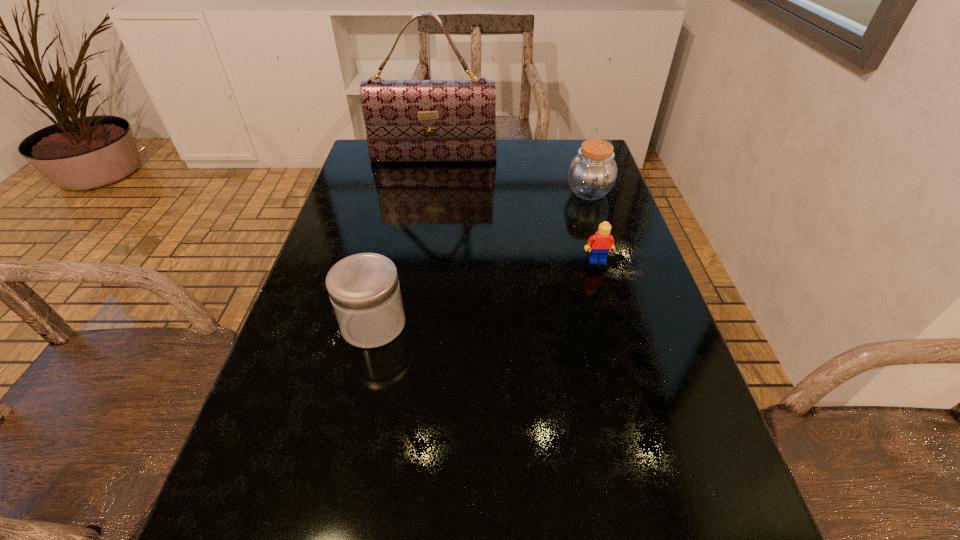
Find the location of a particular element. This screenshot has width=960, height=540. the tallest object is located at coordinates (406, 120).

Identify the location of the farthest object. Image resolution: width=960 pixels, height=540 pixels. (406, 120).

Image resolution: width=960 pixels, height=540 pixels. Find the location of `the farther jar`. the farther jar is located at coordinates (592, 173).

The image size is (960, 540). What are the coordinates of `the third nearest object` in the screenshot? It's located at (592, 173).

The width and height of the screenshot is (960, 540). I want to click on the nearest object, so click(364, 290).

What are the coordinates of `the nearer jar` in the screenshot? It's located at (364, 290).

Locate an element on the screen. This screenshot has height=540, width=960. Lego is located at coordinates (601, 243).

Locate an element on the screen. Image resolution: width=960 pixels, height=540 pixels. the shortest object is located at coordinates (601, 243).

You are a GUI agent. You are given a task and a screenshot of the screen. Output one action in this format:
    pyautogui.click(x=<x>, y=<y>)
    Task: Click on the free space located 0.350m on the front of the farthest object with the clasp
    Image resolution: width=960 pixels, height=540 pixels.
    Given the screenshot: What is the action you would take?
    (x=421, y=242)

You are a GUI agent. You are given a task and a screenshot of the screen. Output one action in this format:
    pyautogui.click(x=<x>, y=<y>)
    Task: Click on the vacant space located on the left of the farther jar
    The width and height of the screenshot is (960, 540).
    Given the screenshot: What is the action you would take?
    pyautogui.click(x=537, y=192)